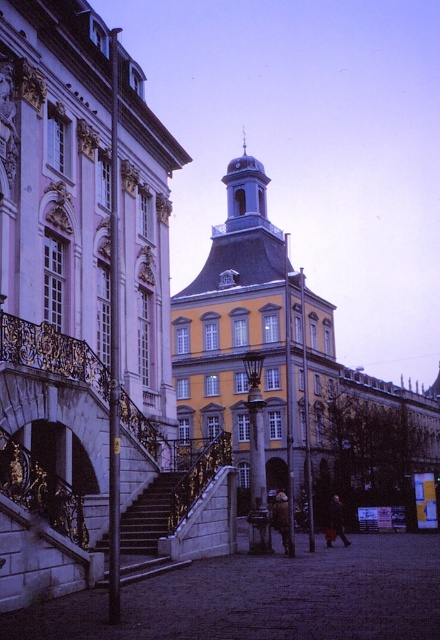
Question: Which point appears farthest from the camera in this image?

Choices:
 (A) (312, 371)
 (B) (124, 538)
 (C) (293, 554)
 (D) (337, 496)

Answer: (A)

Question: In this image, where is dark gray stone stairs at center located relative to camouflage jacket at center?

Choices:
 (A) right
 (B) left

Answer: (B)

Question: Which object is the farthest from the dark gray stone stairs at center?

Choices:
 (A) yellow matte building at center
 (B) dark brown leather coat at center

Answer: (A)

Question: Does yellow matte building at center appear under dark gray stone stairs at center?

Choices:
 (A) no
 (B) yes

Answer: (A)

Question: Which is nearer to the dark brown leather coat at center?

Choices:
 (A) camouflage jacket at center
 (B) dark gray stone stairs at center
 (C) yellow matte building at center

Answer: (A)

Question: Is the position of camouflage jacket at center less distant than that of dark brown leather coat at center?

Choices:
 (A) yes
 (B) no

Answer: (A)